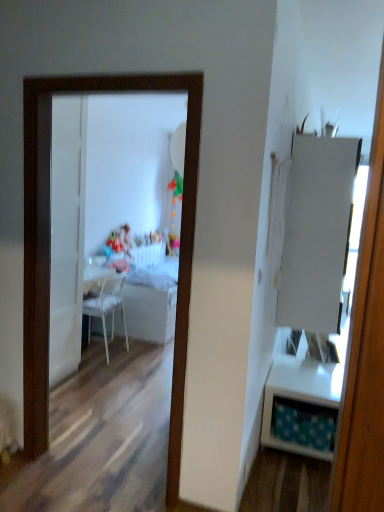
Question: From a real-world perspective, is matte plastic toy at center beneath white matte cabinet at right?

Choices:
 (A) yes
 (B) no

Answer: (A)

Question: Is matte plastic toy at center surrounding white matte cabinet at right?

Choices:
 (A) yes
 (B) no

Answer: (B)

Question: Is the depth of matte plastic toy at center greater than that of white matte cabinet at right?

Choices:
 (A) no
 (B) yes

Answer: (B)

Question: Considering the relative sizes of matte plastic toy at center and white matte cabinet at right in the image provided, is matte plastic toy at center smaller than white matte cabinet at right?

Choices:
 (A) yes
 (B) no

Answer: (A)

Question: Is matte plastic toy at center aimed at white matte cabinet at right?

Choices:
 (A) yes
 (B) no

Answer: (B)

Question: Is matte plastic toy at center placed right next to white matte cabinet at right?

Choices:
 (A) yes
 (B) no

Answer: (B)

Question: Is white matte cabinet at right touching white glossy mirror at center?

Choices:
 (A) yes
 (B) no

Answer: (B)

Question: Is white matte cabinet at right facing away from white glossy mirror at center?

Choices:
 (A) no
 (B) yes

Answer: (A)

Question: From a real-world perspective, is white matte cabinet at right physically below white glossy mirror at center?

Choices:
 (A) yes
 (B) no

Answer: (B)

Question: Is white matte cabinet at right not close to white glossy mirror at center?

Choices:
 (A) yes
 (B) no

Answer: (A)

Question: From the image's perspective, is white matte cabinet at right over white glossy mirror at center?

Choices:
 (A) no
 (B) yes

Answer: (B)

Question: Can you confirm if white matte cabinet at right is thinner than white glossy mirror at center?

Choices:
 (A) yes
 (B) no

Answer: (B)

Question: Would you say white glossy mirror at center is part of white plastic chair at center's contents?

Choices:
 (A) no
 (B) yes

Answer: (A)